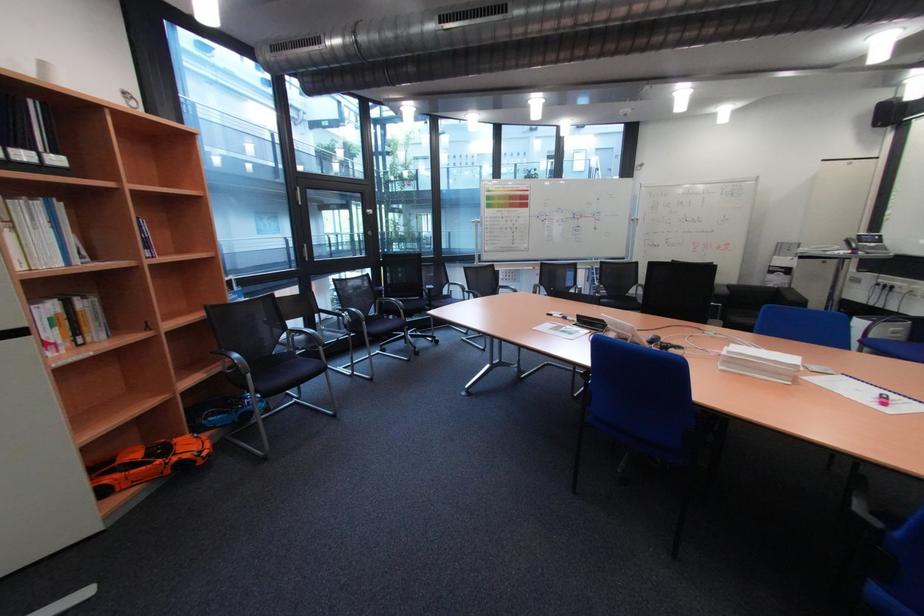
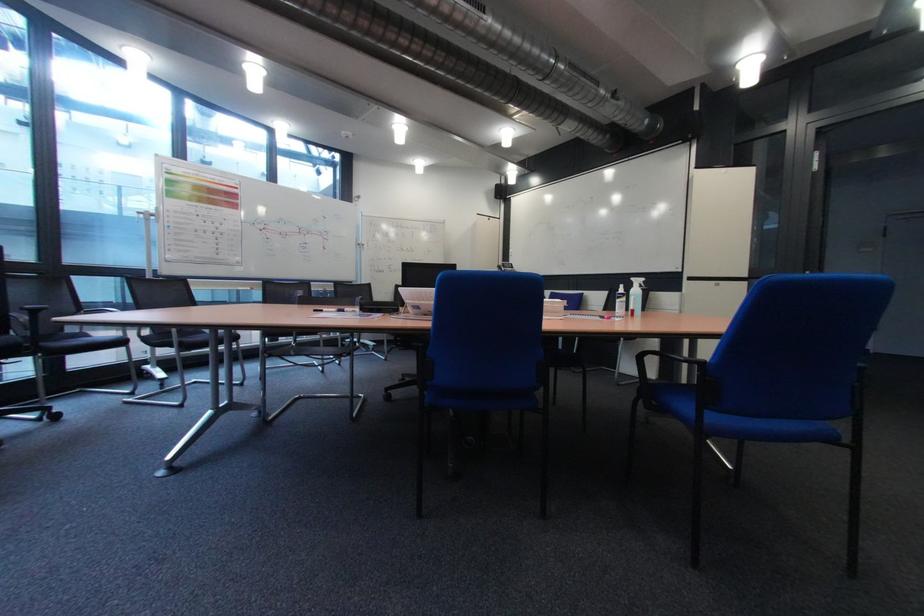
Question: How did the camera likely rotate?

Choices:
 (A) Left
 (B) Right
 (C) Up
 (D) Down

Answer: (B)